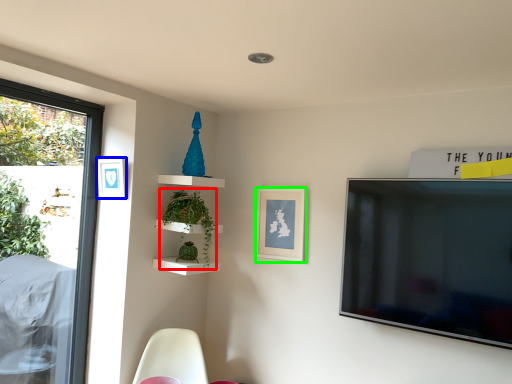
Question: Which object is the farthest from plant (highlighted by a red box)? Choose among these: picture frame (highlighted by a blue box) or picture frame (highlighted by a green box).

Choices:
 (A) picture frame
 (B) picture frame

Answer: (B)